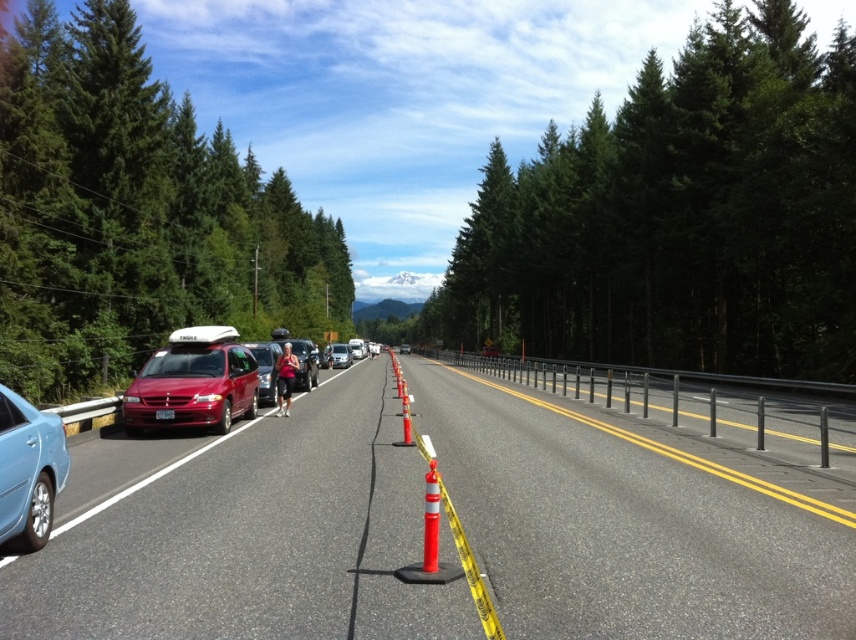
Question: Which of the following is the closest to the observer?

Choices:
 (A) (342, 349)
 (B) (429, 481)

Answer: (B)

Question: Estimate the real-world distances between objects in this image. Which object is farther from the green leafy trees at center?

Choices:
 (A) metallic silver van at center
 (B) matte silver van at center
 (C) shiny red minivan at center-left
 (D) orange reflective traffic cone at center

Answer: (D)

Question: Considering the relative positions of light blue metallic sedan at lower left and matte red van at center in the image provided, where is light blue metallic sedan at lower left located with respect to matte red van at center?

Choices:
 (A) above
 (B) below

Answer: (A)

Question: Is smooth asphalt road at center below metallic silver van at center?

Choices:
 (A) yes
 (B) no

Answer: (A)

Question: Among these objects, which one is farthest from the camera?

Choices:
 (A) smooth asphalt highway at center
 (B) green leafy trees at center

Answer: (B)

Question: Can you confirm if orange reflective traffic cone at center is wider than matte silver van at center?

Choices:
 (A) no
 (B) yes

Answer: (A)